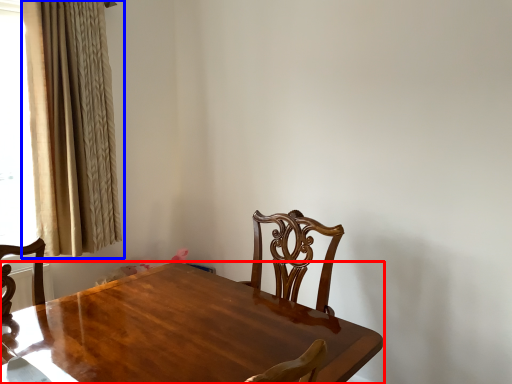
Question: Which of the following is the farthest to the observer, table (highlighted by a red box) or curtain (highlighted by a blue box)?

Choices:
 (A) table
 (B) curtain

Answer: (B)